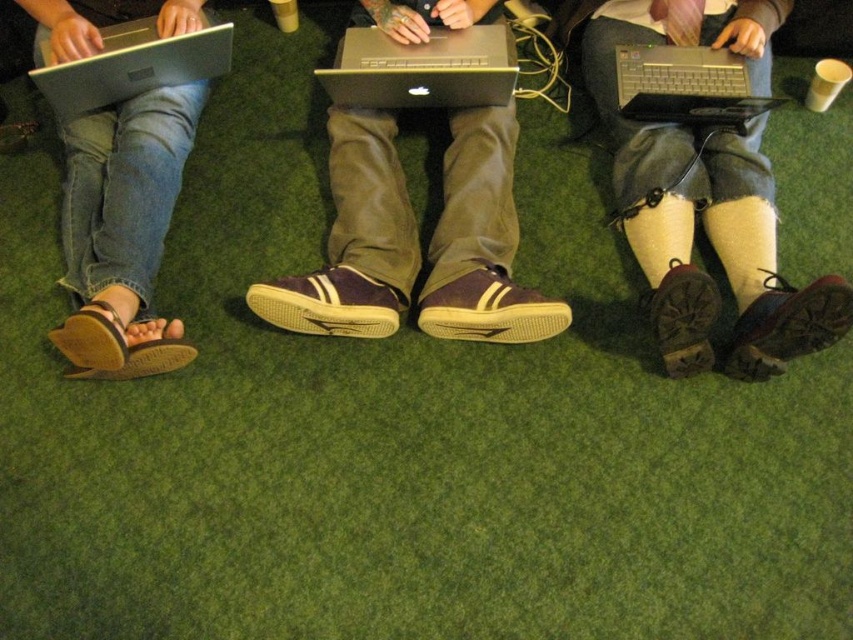
You are standing in the scene and want to move from the point at coordinates point [624,60] to the point at coordinates point [474,323]. Which direction should you move to get closer to the latter?

To move from point [624,60] to point [474,323], you should move towards the right and forward since point [474,323] is closer to the viewer than point [624,60].

You are organizing a shoe storage rack and need to place the brown leather sandals at lower left and the brown suede shoe at lower right. Based on the scene description, which one requires a wider space in the rack?

The brown leather sandals at lower left require a wider space in the rack because they might be wider than the brown suede shoe at lower right according to the description.